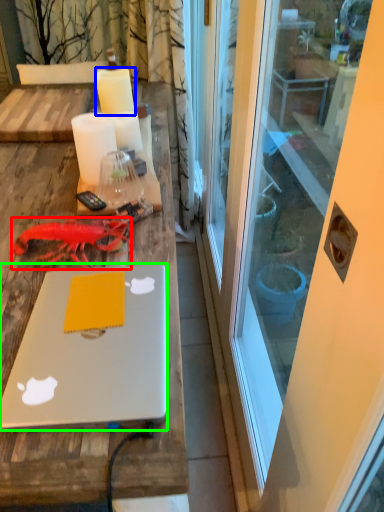
Question: Which object is positioned farthest from lobster (highlighted by a red box)? Select from candle (highlighted by a blue box) and laptop (highlighted by a green box).

Choices:
 (A) candle
 (B) laptop

Answer: (A)